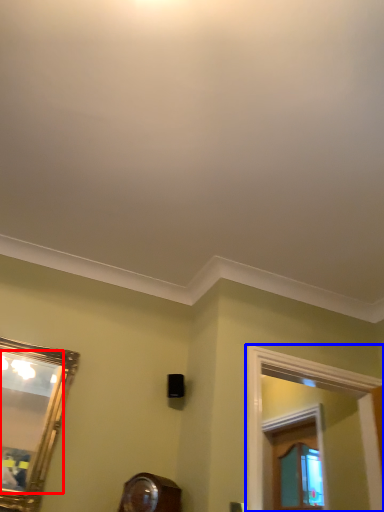
Question: Which object is closer to the camera taking this photo, mirror (highlighted by a red box) or window frame (highlighted by a blue box)?

Choices:
 (A) mirror
 (B) window frame

Answer: (A)